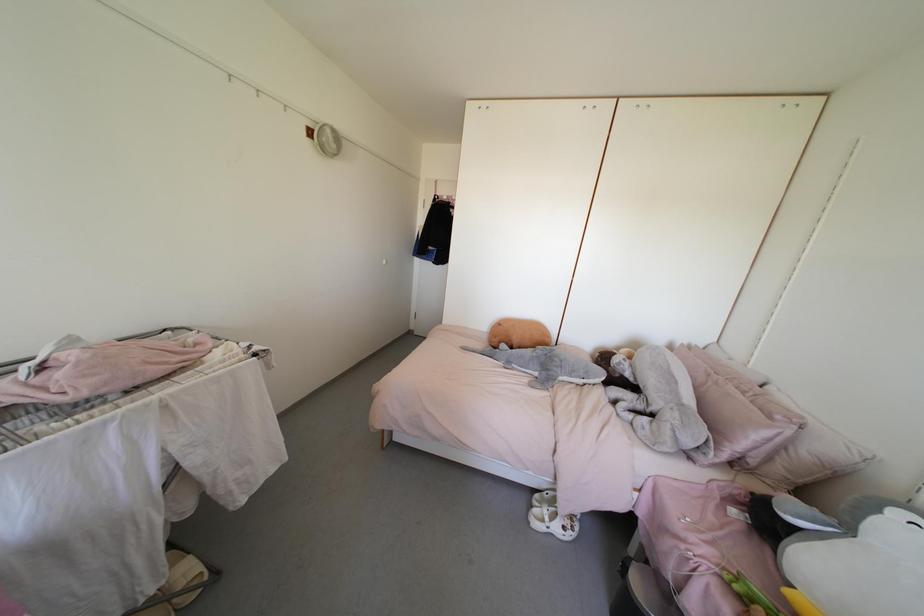
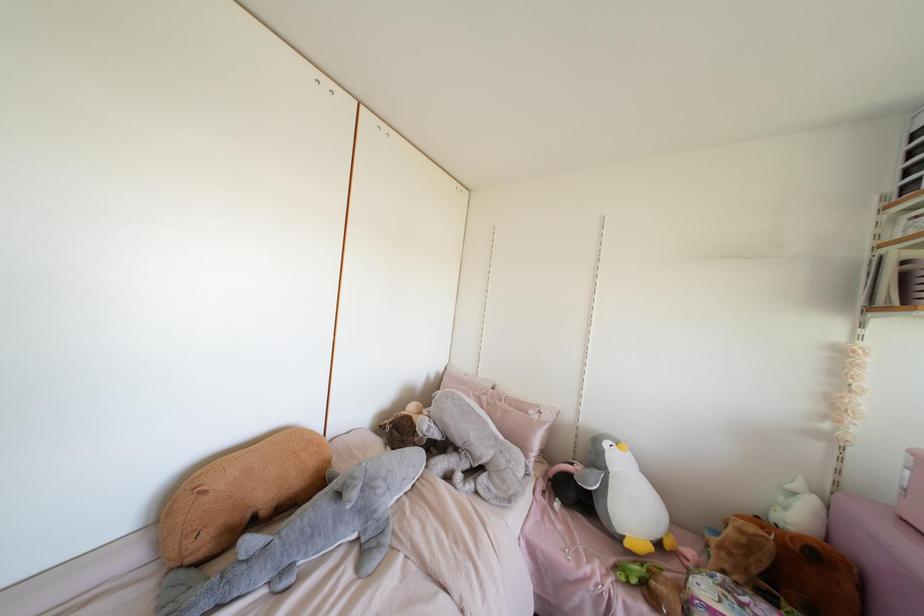
Question: How did the camera likely rotate?

Choices:
 (A) Left
 (B) Right
 (C) Up
 (D) Down

Answer: (B)